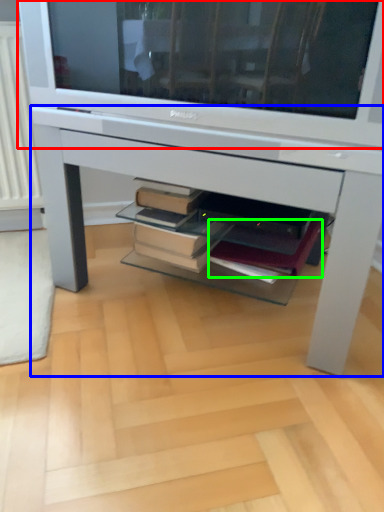
Question: Based on their relative distances, which object is nearer to television (highlighted by a red box)? Choose from desk (highlighted by a blue box) and paperback book (highlighted by a green box).

Choices:
 (A) desk
 (B) paperback book

Answer: (A)